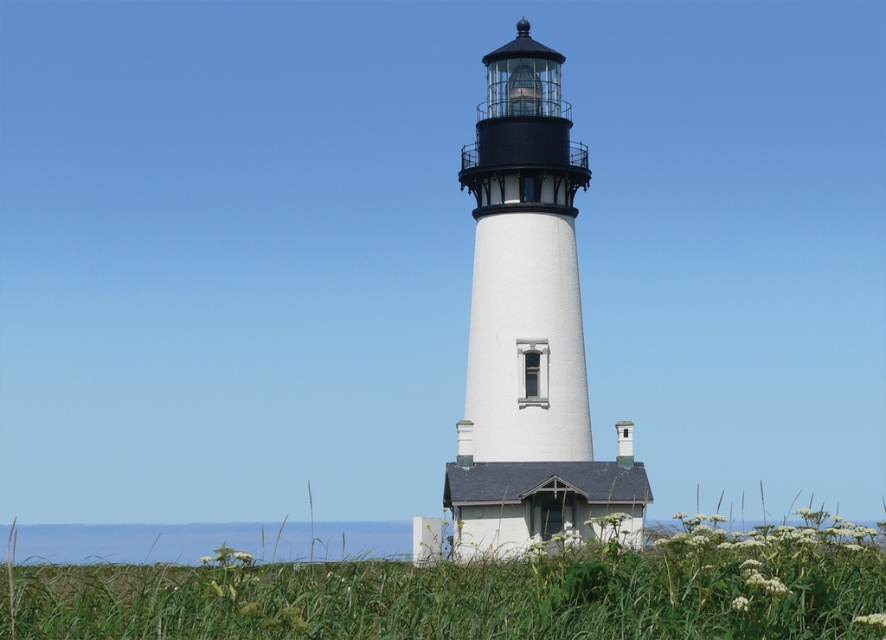
You are standing at the base of the lighthouse and looking towards the horizon. There is a point marked at coordinates (480,592). What is located at that point?

At point (480,592) lies green grass at center.

You are standing in front of the white painted concrete lighthouse at center and want to walk towards the green grass at center. Which direction should you move?

You should move to your left because the green grass at center is located to the left of the white painted concrete lighthouse at center.

You are a gardener who wants to mow the green grass at center near the white painted concrete lighthouse at center. Which object is shorter so you can decide which to mow first?

The green grass at center has a lesser height compared to the white painted concrete lighthouse at center, so you should mow the green grass at center first since it is shorter.